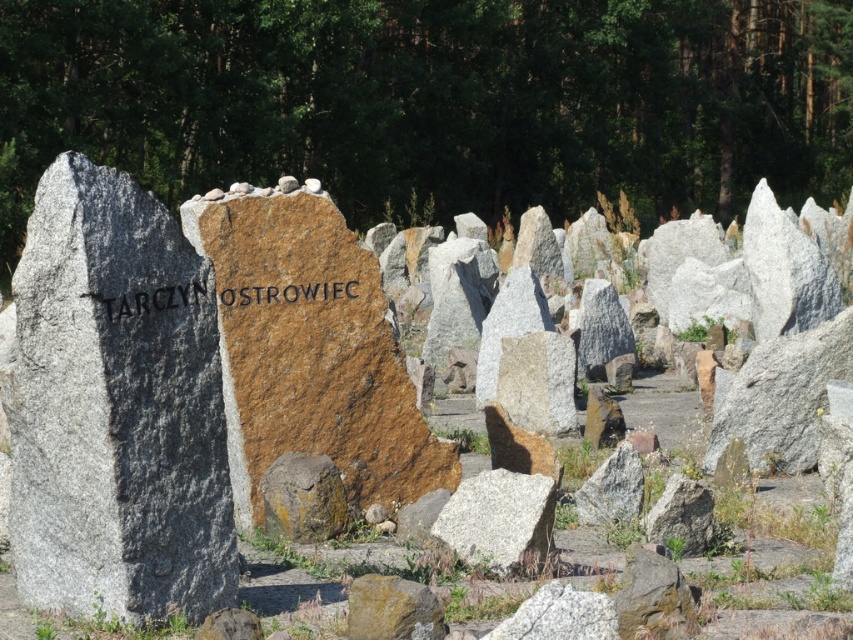
Question: Does white granite rock at center have a lesser width compared to yellowish-brown rock at center?

Choices:
 (A) no
 (B) yes

Answer: (A)

Question: Estimate the real-world distances between objects in this image. Which object is closer to the brown stone engraving at center?

Choices:
 (A) yellowish-brown rock at center
 (B) brown stone at center

Answer: (B)

Question: Is brown stone at center smaller than white granite rock at center?

Choices:
 (A) no
 (B) yes

Answer: (A)

Question: Which point appears farthest from the camera in this image?

Choices:
 (A) (170, 296)
 (B) (524, 499)
 (C) (318, 540)

Answer: (C)

Question: Can you confirm if brown stone at center is positioned to the right of brown stone engraving at center?

Choices:
 (A) no
 (B) yes

Answer: (A)

Question: Estimate the real-world distances between objects in this image. Which object is farther from the brown stone engraving at center?

Choices:
 (A) brown stone at center
 (B) white granite rock at center
 (C) yellowish-brown rock at center

Answer: (B)